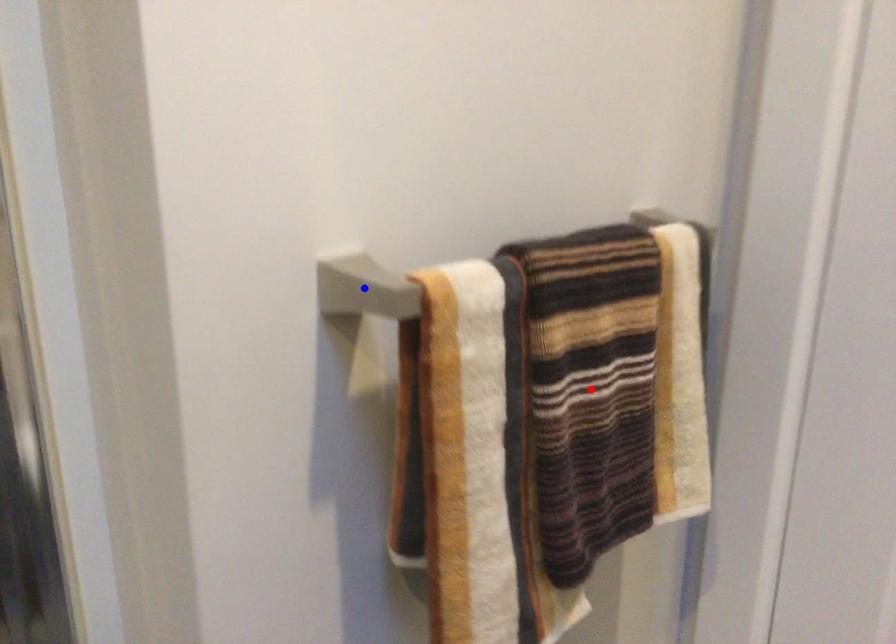
Question: Two points are marked on the image. Which point is closer to the camera?

Choices:
 (A) Blue point is closer.
 (B) Red point is closer.

Answer: (A)